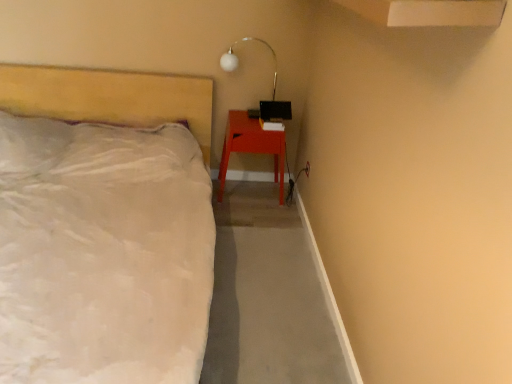
Question: Considering the relative sizes of matte wood nightstand at lower right and white glass lamp at upper center in the image provided, is matte wood nightstand at lower right shorter than white glass lamp at upper center?

Choices:
 (A) no
 (B) yes

Answer: (A)

Question: Can you confirm if matte wood nightstand at lower right is smaller than white glass lamp at upper center?

Choices:
 (A) yes
 (B) no

Answer: (B)

Question: Is matte wood nightstand at lower right next to white glass lamp at upper center?

Choices:
 (A) yes
 (B) no

Answer: (B)

Question: Is matte wood nightstand at lower right thinner than white glass lamp at upper center?

Choices:
 (A) yes
 (B) no

Answer: (B)

Question: Considering the relative sizes of matte wood nightstand at lower right and white glass lamp at upper center in the image provided, is matte wood nightstand at lower right wider than white glass lamp at upper center?

Choices:
 (A) yes
 (B) no

Answer: (A)

Question: From the image's perspective, relative to white glass lamp at upper center, is matte white bed at left above or below?

Choices:
 (A) below
 (B) above

Answer: (A)

Question: Considering the positions of matte white bed at left and white glass lamp at upper center in the image, is matte white bed at left wider or thinner than white glass lamp at upper center?

Choices:
 (A) wide
 (B) thin

Answer: (A)

Question: Considering the relative positions of matte white bed at left and white glass lamp at upper center in the image provided, is matte white bed at left to the left or to the right of white glass lamp at upper center?

Choices:
 (A) left
 (B) right

Answer: (A)

Question: From a real-world perspective, is matte white bed at left above or below white glass lamp at upper center?

Choices:
 (A) below
 (B) above

Answer: (A)

Question: Would you say matte white bed at left is to the left or to the right of matte wood nightstand at lower right in the picture?

Choices:
 (A) right
 (B) left

Answer: (B)

Question: Considering the positions of matte white bed at left and matte wood nightstand at lower right in the image, is matte white bed at left taller or shorter than matte wood nightstand at lower right?

Choices:
 (A) tall
 (B) short

Answer: (A)

Question: From a real-world perspective, is matte white bed at left above or below matte wood nightstand at lower right?

Choices:
 (A) above
 (B) below

Answer: (A)

Question: Looking at their shapes, would you say matte white bed at left is wider or thinner than matte wood nightstand at lower right?

Choices:
 (A) wide
 (B) thin

Answer: (A)

Question: Is point (220, 61) closer or farther from the camera than point (217, 192)?

Choices:
 (A) closer
 (B) farther

Answer: (A)

Question: In the image, is white glass lamp at upper center positioned in front of or behind matte wood nightstand at lower right?

Choices:
 (A) front
 (B) behind

Answer: (A)